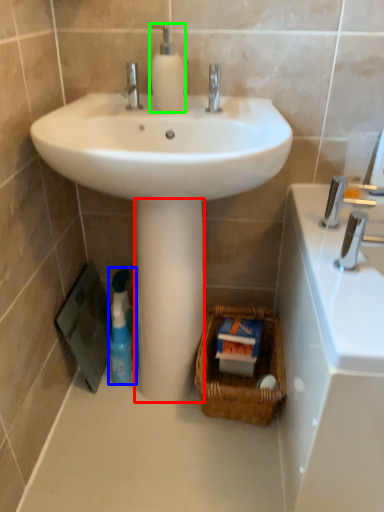
Question: Which is farther away from pillar (highlighted by a red box)? cleaning product (highlighted by a blue box) or soap dispenser (highlighted by a green box)?

Choices:
 (A) cleaning product
 (B) soap dispenser

Answer: (B)